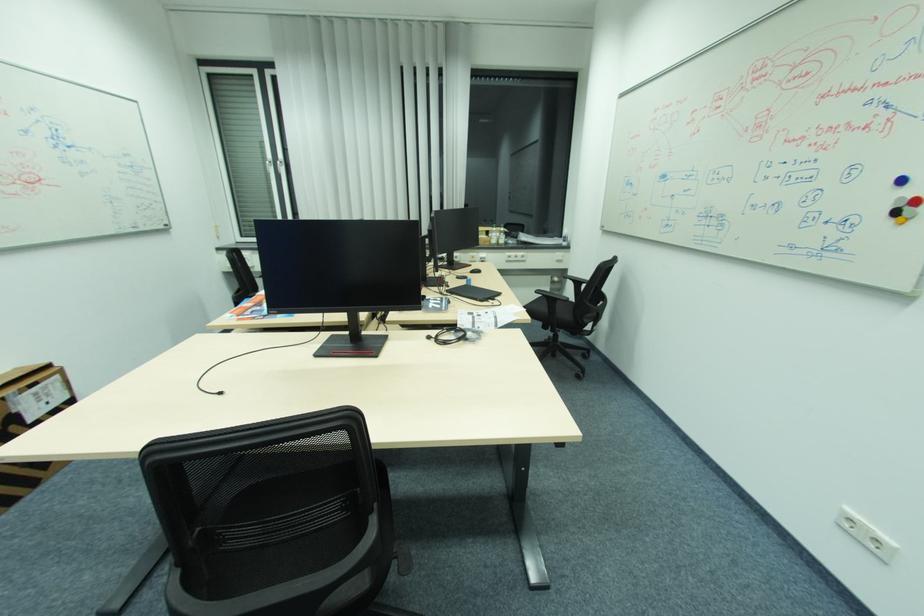
This screenshot has height=616, width=924. What do you see at coordinates (450, 336) in the screenshot? I see `the black coiled cable` at bounding box center [450, 336].